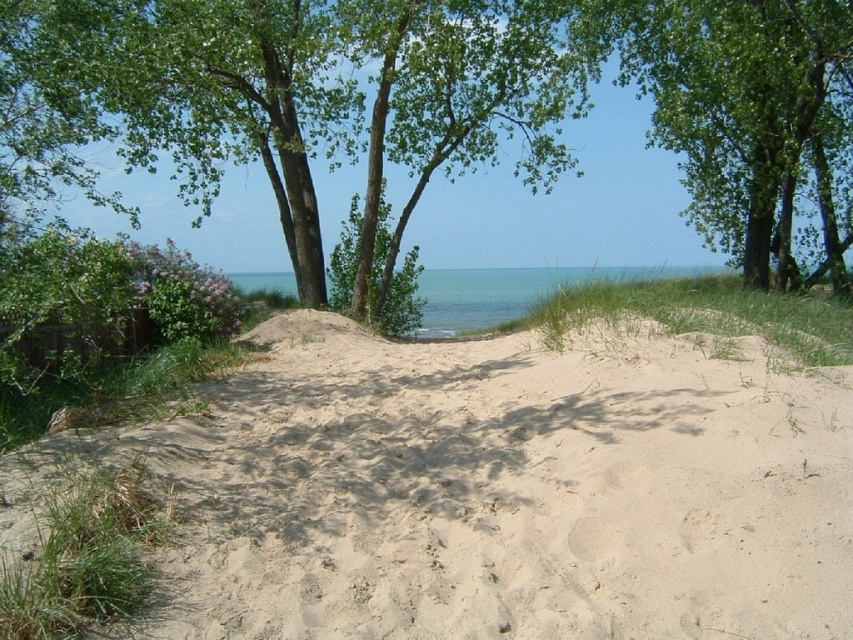
Is the position of light beige sand at center more distant than that of green leafy tree at center?

No, it is not.

Locate an element on the screen. This screenshot has width=853, height=640. light beige sand at center is located at coordinates (492, 492).

Does point (825, 550) come closer to viewer compared to point (752, 211)?

Yes, point (825, 550) is in front of point (752, 211).

Locate an element on the screen. light beige sand at center is located at coordinates (492, 492).

Does green leafy tree at upper right appear on the right side of blue water at center?

Indeed, green leafy tree at upper right is positioned on the right side of blue water at center.

Who is higher up, green leafy tree at upper right or blue water at center?

green leafy tree at upper right

The height and width of the screenshot is (640, 853). Find the location of `green leafy tree at upper right`. green leafy tree at upper right is located at coordinates (727, 99).

This screenshot has height=640, width=853. Find the location of `green leafy tree at upper right`. green leafy tree at upper right is located at coordinates (727, 99).

Can you confirm if light beige sand at center is thinner than green leafy tree at upper right?

No, light beige sand at center is not thinner than green leafy tree at upper right.

Can you confirm if light beige sand at center is positioned to the left of green leafy tree at upper right?

Yes, light beige sand at center is to the left of green leafy tree at upper right.

Does point (817, 522) come in front of point (721, 236)?

Yes, point (817, 522) is closer to viewer.

Where is `light beige sand at center`? light beige sand at center is located at coordinates (492, 492).